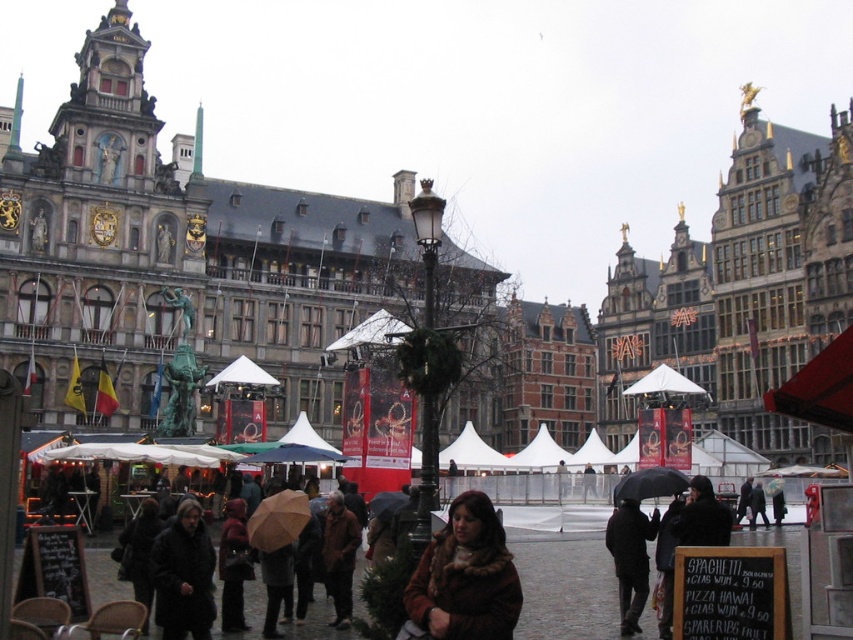
Does dark brown leather coat at lower left appear under brown woolen coat at center?

No, dark brown leather coat at lower left is not below brown woolen coat at center.

Which is more to the left, dark brown leather coat at lower left or brown woolen coat at center?

dark brown leather coat at lower left

What are the coordinates of `dark brown leather coat at lower left` in the screenshot? It's located at (183, 576).

Locate an element on the screen. dark brown leather coat at lower left is located at coordinates (183, 576).

Is brown fur coat at center below brown woolen coat at center?

Actually, brown fur coat at center is above brown woolen coat at center.

Is brown fur coat at center taller than brown woolen coat at center?

Yes, brown fur coat at center is taller than brown woolen coat at center.

Who is more distant from viewer, (418, 605) or (584, 483)?

Positioned behind is point (584, 483).

Locate an element on the screen. The image size is (853, 640). brown fur coat at center is located at coordinates (465, 577).

Who is positioned more to the right, dark matte coat at lower center or brown woolen coat at center?

From the viewer's perspective, brown woolen coat at center appears more on the right side.

Does dark matte coat at lower center appear under brown woolen coat at center?

Indeed, dark matte coat at lower center is positioned under brown woolen coat at center.

Between point (633, 605) and point (589, 461), which one is positioned in front?

Point (633, 605) is in front.

Find the location of `dark matte coat at lower center`. dark matte coat at lower center is located at coordinates (630, 560).